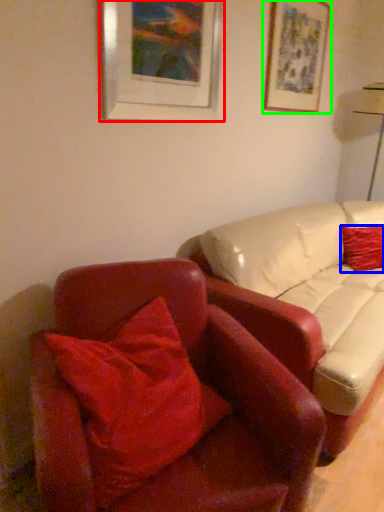
Question: Considering the real-world distances, which object is closest to picture frame (highlighted by a red box)? pillow (highlighted by a blue box) or picture frame (highlighted by a green box).

Choices:
 (A) pillow
 (B) picture frame

Answer: (B)